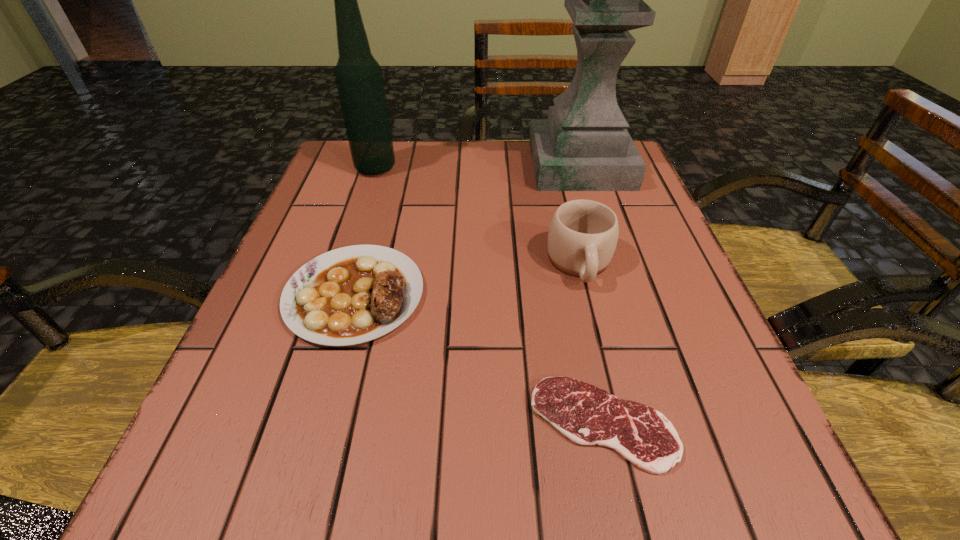
Identify the location of free space that satisfies the following two spatial constraints: 1. at the front opening of the tallest object; 2. on the front side of the alcohol. This screenshot has width=960, height=540. (581, 168).

The height and width of the screenshot is (540, 960). I want to click on vacant area in the image that satisfies the following two spatial constraints: 1. at the front opening of the tallest object; 2. on the side of the third tallest object with the handle, so click(x=612, y=264).